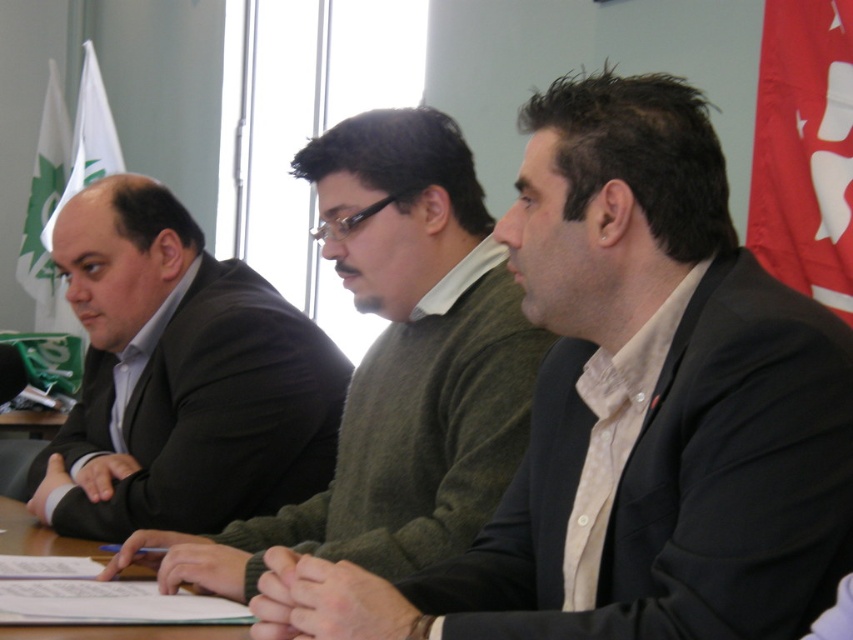
Based on the photo, between dark green sweater at center and dark brown suit at left, which one appears on the left side from the viewer's perspective?

Positioned to the left is dark brown suit at left.

Is point (646, 369) positioned in front of point (331, 460)?

Yes, point (646, 369) is closer to viewer.

Between point (798, 328) and point (73, 525), which one is positioned in front?

Point (798, 328) is more forward.

At what (x,y) coordinates should I click in order to perform the action: click on dark green sweater at center. Please return your answer as a coordinate pair (x, y). The width and height of the screenshot is (853, 640). Looking at the image, I should click on (633, 412).

Does green sweater at center have a larger size compared to wooden table at center?

Yes, green sweater at center is bigger than wooden table at center.

Is point (416, 269) in front of point (39, 545)?

That is True.

Image resolution: width=853 pixels, height=640 pixels. I want to click on green sweater at center, so click(x=398, y=364).

Measure the distance from green sweater at center to dark brown suit at left.

The distance of green sweater at center from dark brown suit at left is 18.43 inches.

Who is more distant from viewer, [270,522] or [173,387]?

The point [173,387] is more distant.

You are a GUI agent. You are given a task and a screenshot of the screen. Output one action in this format:
    pyautogui.click(x=<x>, y=<y>)
    Task: Click on the green sweater at center
    
    Given the screenshot: What is the action you would take?
    pyautogui.click(x=398, y=364)

At what (x,y) coordinates should I click in order to perform the action: click on green sweater at center. Please return your answer as a coordinate pair (x, y). This screenshot has width=853, height=640. Looking at the image, I should click on (398, 364).